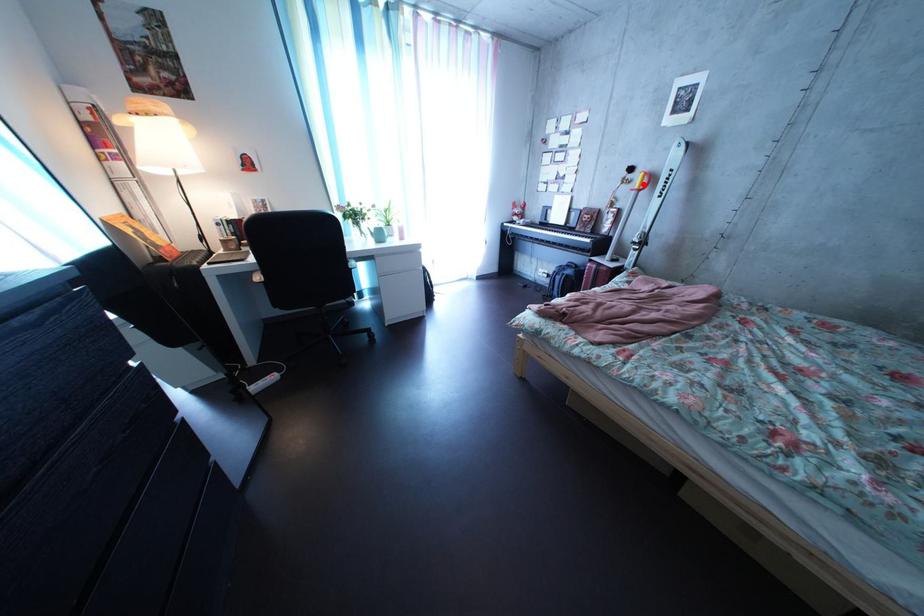
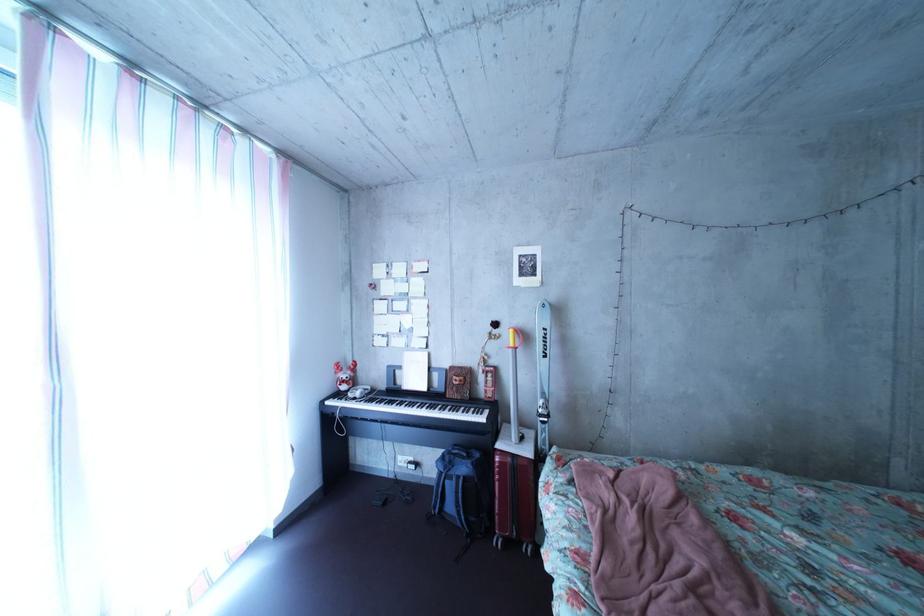
Question: I am providing you with two images of the same scene from different viewpoints. A red point is shown in image1. For the corresponding object point in image2, is it positioned nearer or farther from the camera?

Choices:
 (A) Nearer
 (B) Farther

Answer: (B)